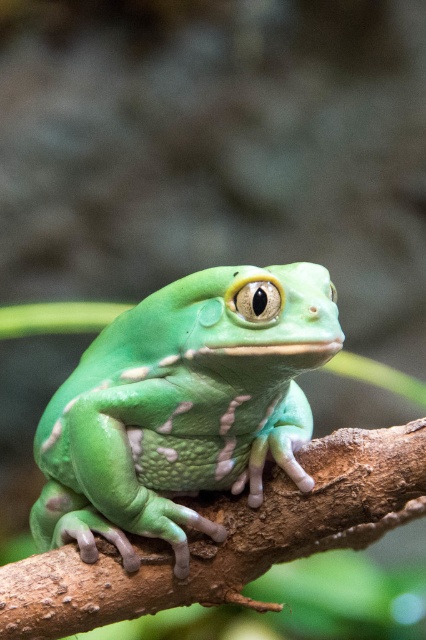
Question: Which of the following is the farthest from the observer?

Choices:
 (A) (236, 536)
 (B) (80, 385)

Answer: (B)

Question: Among these objects, which one is nearest to the camera?

Choices:
 (A) brown rough tree branch at center
 (B) green matte frog at center

Answer: (B)

Question: Can you confirm if green matte frog at center is positioned to the left of brown rough tree branch at center?

Choices:
 (A) no
 (B) yes

Answer: (B)

Question: Is green matte frog at center wider than brown rough tree branch at center?

Choices:
 (A) no
 (B) yes

Answer: (A)

Question: Can you confirm if green matte frog at center is positioned above brown rough tree branch at center?

Choices:
 (A) no
 (B) yes

Answer: (B)